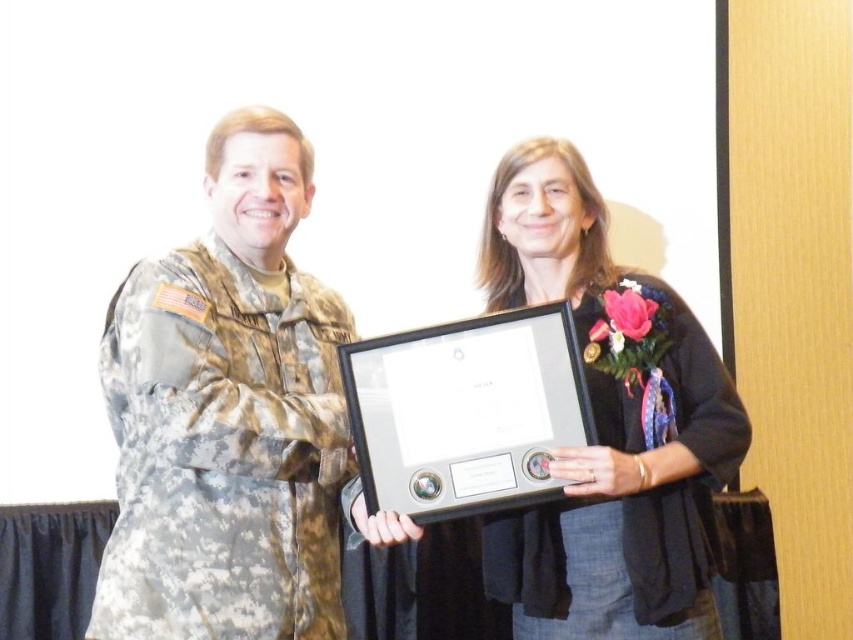
Is point (567, 182) in front of point (140, 337)?

That is False.

Between point (286, 467) and point (160, 470), which one is positioned behind?

Point (286, 467)

At what (x,y) coordinates should I click in order to perform the action: click on matte black frame at center. Please return your answer as a coordinate pair (x, y). Looking at the image, I should click on (230, 413).

Is camouflage fabric uniform at left shorter than matte black uniform at center?

In fact, camouflage fabric uniform at left may be taller than matte black uniform at center.

Does camouflage fabric uniform at left appear on the left side of matte black uniform at center?

Yes, camouflage fabric uniform at left is to the left of matte black uniform at center.

The height and width of the screenshot is (640, 853). Identify the location of camouflage fabric uniform at left. (223, 451).

The height and width of the screenshot is (640, 853). In order to click on camouflage fabric uniform at left in this screenshot , I will do `click(223, 451)`.

Which is above, matte black frame at center or matte black uniform at center?

matte black frame at center

Between point (705, 476) and point (677, 392), which one is positioned behind?

Positioned behind is point (677, 392).

This screenshot has width=853, height=640. I want to click on matte black frame at center, so click(x=230, y=413).